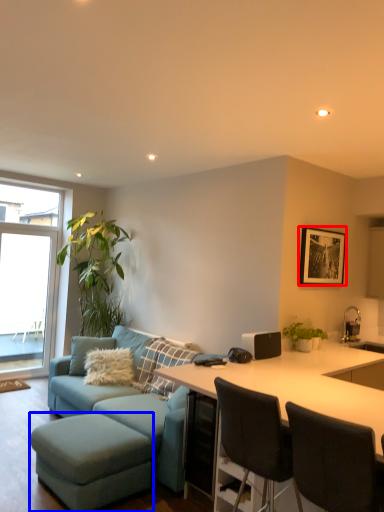
Question: Which object is closer to the camera taking this photo, picture frame (highlighted by a red box) or bar stool (highlighted by a blue box)?

Choices:
 (A) picture frame
 (B) bar stool

Answer: (B)